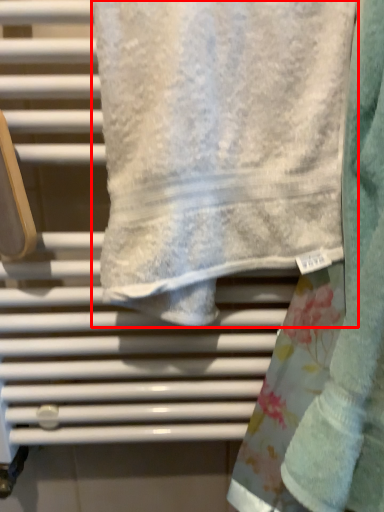
Question: From the image's perspective, where is towel (annotated by the red box) located in relation to towel in the image?

Choices:
 (A) below
 (B) above

Answer: (B)